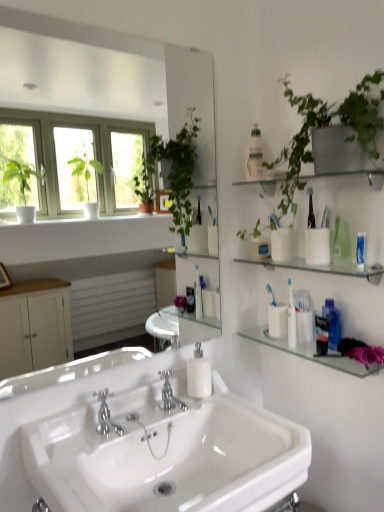
At what (x,y) coordinates should I click in order to perform the action: click on white plastic bottle at upper center, positioned as the 1th toiletry in top-to-bottom order. Please return your answer as a coordinate pair (x, y). This screenshot has height=512, width=384. Looking at the image, I should click on (255, 156).

Describe the element at coordinates (354, 174) in the screenshot. I see `clear glass shelf at upper right, the 1th shelf positioned from the top` at that location.

Identify the location of clear glass shelf at upper right, the 1th shelf positioned from the top. Image resolution: width=384 pixels, height=512 pixels. (354, 174).

What do you see at coordinates (198, 374) in the screenshot?
I see `white matte soap dispenser at center` at bounding box center [198, 374].

This screenshot has width=384, height=512. What are the coordinates of `chrome metallic faucet at center, which ranks as the first tap in left-to-right order` in the screenshot? It's located at (106, 416).

The image size is (384, 512). Describe the element at coordinates (323, 267) in the screenshot. I see `clear glass shelf at upper right, which appears as the second shelf when ordered from the bottom` at that location.

What is the approximate height of clear glass shelf at upper right, which appears as the second shelf when ordered from the bottom?

0.42 inches.

Find the location of a particular element. The image size is (384, 512). white plastic bottle at upper center, positioned as the 1th toiletry in top-to-bottom order is located at coordinates (255, 156).

From the image's perspective, between clear glass shelf at upper right, the third shelf from the bottom, and clear glass shelf at right, marked as the first shelf in a bottom-to-top arrangement, who is located below?

clear glass shelf at right, marked as the first shelf in a bottom-to-top arrangement, appears lower in the image.

How much distance is there between clear glass shelf at upper right, the 1th shelf positioned from the top, and clear glass shelf at right, the 3th shelf positioned from the top?

clear glass shelf at upper right, the 1th shelf positioned from the top, and clear glass shelf at right, the 3th shelf positioned from the top, are 53.35 centimeters apart.

Is clear glass shelf at upper right, the 1th shelf positioned from the top, completely or partially outside of clear glass shelf at right, the 3th shelf positioned from the top?

Indeed, clear glass shelf at upper right, the 1th shelf positioned from the top, is completely outside clear glass shelf at right, the 3th shelf positioned from the top.

From a real-world perspective, between clear glass shelf at upper right, the third shelf from the bottom, and clear glass shelf at right, marked as the first shelf in a bottom-to-top arrangement, who is vertically lower?

In real-world perspective, clear glass shelf at right, marked as the first shelf in a bottom-to-top arrangement, is lower.

Is clear glass shelf at right, the 3th shelf positioned from the top, not near chrome metallic faucet at center, which ranks as the first tap in left-to-right order?

clear glass shelf at right, the 3th shelf positioned from the top, is near chrome metallic faucet at center, which ranks as the first tap in left-to-right order, not far away.

The image size is (384, 512). What are the coordinates of `the 3rd shelf behind the chrome metallic faucet at center, which is the second tap from right to left` in the screenshot? It's located at (310, 352).

Which is more to the left, clear glass shelf at right, marked as the first shelf in a bottom-to-top arrangement, or chrome metallic faucet at center, which is the second tap from right to left?

chrome metallic faucet at center, which is the second tap from right to left.

Could you tell me if clear glass shelf at right, marked as the first shelf in a bottom-to-top arrangement, is turned towards chrome metallic faucet at center, the 1th tap positioned from the front?

No, clear glass shelf at right, marked as the first shelf in a bottom-to-top arrangement, is not oriented towards chrome metallic faucet at center, the 1th tap positioned from the front.

Can you confirm if white matte soap dispenser at center is thinner than white plastic bottle at upper center, positioned as the 1th toiletry in left-to-right order?

In fact, white matte soap dispenser at center might be wider than white plastic bottle at upper center, positioned as the 1th toiletry in left-to-right order.

Between point (200, 345) and point (252, 147), which one is positioned behind?

The point (200, 345) is more distant.

Is white matte soap dispenser at center looking in the opposite direction of white plastic bottle at upper center, positioned as the 1th toiletry in left-to-right order?

white matte soap dispenser at center is not turned away from white plastic bottle at upper center, positioned as the 1th toiletry in left-to-right order.

In the scene shown: Between clear glass shelf at upper right, which appears as the second shelf when viewed from the top, and clear glass shelf at right, the 3th shelf positioned from the top, which one is positioned behind?

clear glass shelf at right, the 3th shelf positioned from the top.

Does clear glass shelf at upper right, which appears as the second shelf when ordered from the bottom, have a lesser width compared to clear glass shelf at right, marked as the first shelf in a bottom-to-top arrangement?

No.

Who is taller, clear glass shelf at upper right, which appears as the second shelf when viewed from the top, or clear glass shelf at right, the 3th shelf positioned from the top?

With more height is clear glass shelf at right, the 3th shelf positioned from the top.

Considering the positions of objects clear glass shelf at upper right, which appears as the second shelf when ordered from the bottom, and clear glass shelf at right, the 3th shelf positioned from the top, in the image provided, who is more to the left, clear glass shelf at upper right, which appears as the second shelf when ordered from the bottom, or clear glass shelf at right, the 3th shelf positioned from the top,?

clear glass shelf at upper right, which appears as the second shelf when ordered from the bottom.

From the image's perspective, which one is positioned higher, white glossy sink at center or chrome metallic faucet at center, arranged as the 2th tap when viewed from the back?

chrome metallic faucet at center, arranged as the 2th tap when viewed from the back, appears higher in the image.

Is there a large distance between white glossy sink at center and chrome metallic faucet at center, the 1th tap positioned from the front?

white glossy sink at center is near chrome metallic faucet at center, the 1th tap positioned from the front, not far away.

Is white glossy sink at center aimed at chrome metallic faucet at center, which is the second tap from right to left?

No, white glossy sink at center is not turned towards chrome metallic faucet at center, which is the second tap from right to left.

Considering the points (239, 446) and (298, 313), which point is behind, point (239, 446) or point (298, 313)?

The point (298, 313) is farther.

Looking at their sizes, would you say white glossy sink at center is wider or thinner than white matte cup at right, acting as the 2th toiletry starting from the left?

white glossy sink at center is wider than white matte cup at right, acting as the 2th toiletry starting from the left.

The width and height of the screenshot is (384, 512). In order to click on sink in front of the white matte cup at right, acting as the 2th toiletry starting from the left in this screenshot , I will do `click(166, 453)`.

In the image, is chrome metallic faucet at center, the 1th tap positioned from the front, positioned in front of or behind white plastic bottle at upper center, which is the 2th toiletry in bottom-to-top order?

Clearly, chrome metallic faucet at center, the 1th tap positioned from the front, is in front of white plastic bottle at upper center, which is the 2th toiletry in bottom-to-top order.

How far apart are chrome metallic faucet at center, arranged as the 2th tap when viewed from the back, and white plastic bottle at upper center, acting as the second toiletry starting from the right?

35.47 inches.

Based on their sizes in the image, would you say chrome metallic faucet at center, arranged as the 2th tap when viewed from the back, is bigger or smaller than white plastic bottle at upper center, positioned as the 1th toiletry in top-to-bottom order?

Considering their sizes, chrome metallic faucet at center, arranged as the 2th tap when viewed from the back, takes up more space than white plastic bottle at upper center, positioned as the 1th toiletry in top-to-bottom order.

Does point (103, 392) come farther from viewer compared to point (252, 158)?

No, (103, 392) is in front of (252, 158).

Where is `the 2nd shelf to the left of the clear glass shelf at right, marked as the first shelf in a bottom-to-top arrangement, starting your count from the anchor`? This screenshot has width=384, height=512. the 2nd shelf to the left of the clear glass shelf at right, marked as the first shelf in a bottom-to-top arrangement, starting your count from the anchor is located at coordinates (354, 174).

Find the location of a particular element. The image size is (384, 512). the 1st shelf positioned above the chrome metallic faucet at center, which ranks as the first tap in left-to-right order (from the image's perspective) is located at coordinates (310, 352).

Considering their positions, is white plastic bottle at upper center, positioned as the 1th toiletry in top-to-bottom order, positioned closer to clear glass shelf at right, marked as the first shelf in a bottom-to-top arrangement, than clear glass mirror at upper center?

white plastic bottle at upper center, positioned as the 1th toiletry in top-to-bottom order, lies closer to clear glass shelf at right, marked as the first shelf in a bottom-to-top arrangement, than the other object.

From the image, which object appears to be farther from clear glass shelf at right, the 3th shelf positioned from the top, white matte soap dispenser at center or white plastic bottle at upper center, positioned as the 1th toiletry in top-to-bottom order?

Among the two, white plastic bottle at upper center, positioned as the 1th toiletry in top-to-bottom order, is located further to clear glass shelf at right, the 3th shelf positioned from the top.

Considering their positions, is clear glass mirror at upper center positioned further to white matte soap dispenser at center than white glossy sink at center?

Among the two, clear glass mirror at upper center is located further to white matte soap dispenser at center.

Which object lies nearer to the anchor point white glossy sink at center, clear glass shelf at upper right, which appears as the second shelf when viewed from the top, or white matte soap dispenser at center?

white matte soap dispenser at center lies closer to white glossy sink at center than the other object.

Looking at the image, which one is located closer to white glossy sink at center, clear glass shelf at right, marked as the first shelf in a bottom-to-top arrangement, or clear glass shelf at upper right, the third shelf from the bottom?

Based on the image, clear glass shelf at right, marked as the first shelf in a bottom-to-top arrangement, appears to be nearer to white glossy sink at center.

From the image, which object appears to be nearer to clear glass shelf at upper right, which appears as the second shelf when ordered from the bottom, white plastic bottle at upper center, positioned as the 1th toiletry in top-to-bottom order, or chrome metallic faucet at center, which is the second tap from right to left?

white plastic bottle at upper center, positioned as the 1th toiletry in top-to-bottom order, is positioned closer to the anchor clear glass shelf at upper right, which appears as the second shelf when ordered from the bottom.

When comparing their distances from clear glass mirror at upper center, does clear glass shelf at upper right, the 1th shelf positioned from the top, or white matte soap dispenser at center seem further?

clear glass shelf at upper right, the 1th shelf positioned from the top.

Based on their spatial positions, is chrome metallic faucet at center, which is the second tap from right to left, or clear glass shelf at upper right, the 1th shelf positioned from the top, further from white matte soap dispenser at center?

clear glass shelf at upper right, the 1th shelf positioned from the top.

At what (x,y) coordinates should I click in order to perform the action: click on shelf between clear glass mirror at upper center and clear glass shelf at upper right, which appears as the second shelf when viewed from the top, in the horizontal direction. Please return your answer as a coordinate pair (x, y). The image size is (384, 512). Looking at the image, I should click on (354, 174).

At what (x,y) coordinates should I click in order to perform the action: click on toiletry located between clear glass mirror at upper center and clear glass shelf at upper right, the 1th shelf positioned from the top, in the left-right direction. Please return your answer as a coordinate pair (x, y). The width and height of the screenshot is (384, 512). Looking at the image, I should click on (255, 156).

Locate an element on the screen. toiletry between clear glass shelf at upper right, the third shelf from the bottom, and white matte soap dispenser at center from top to bottom is located at coordinates (303, 316).

I want to click on toiletry between white plastic bottle at upper center, positioned as the 1th toiletry in left-to-right order, and clear glass shelf at right, the 3th shelf positioned from the top, from top to bottom, so click(303, 316).